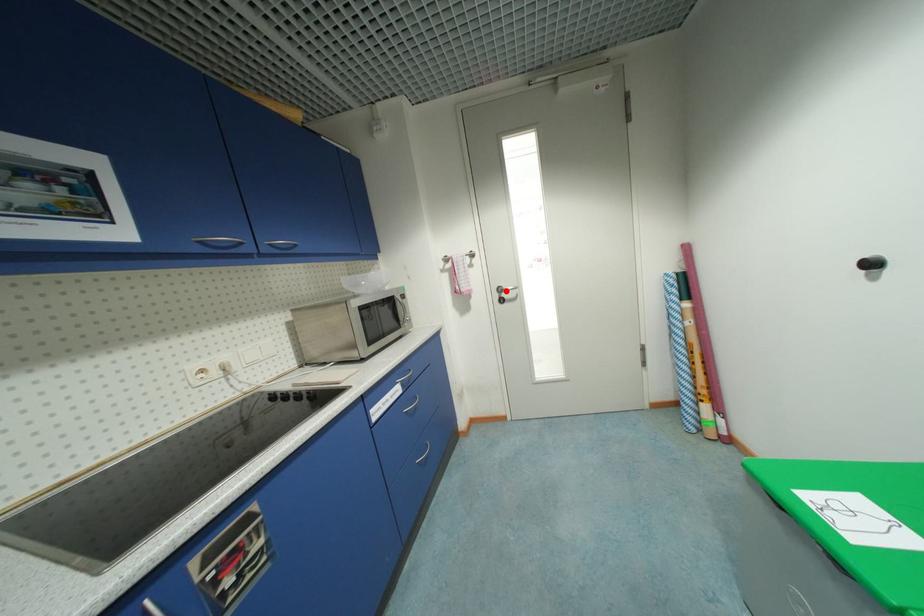
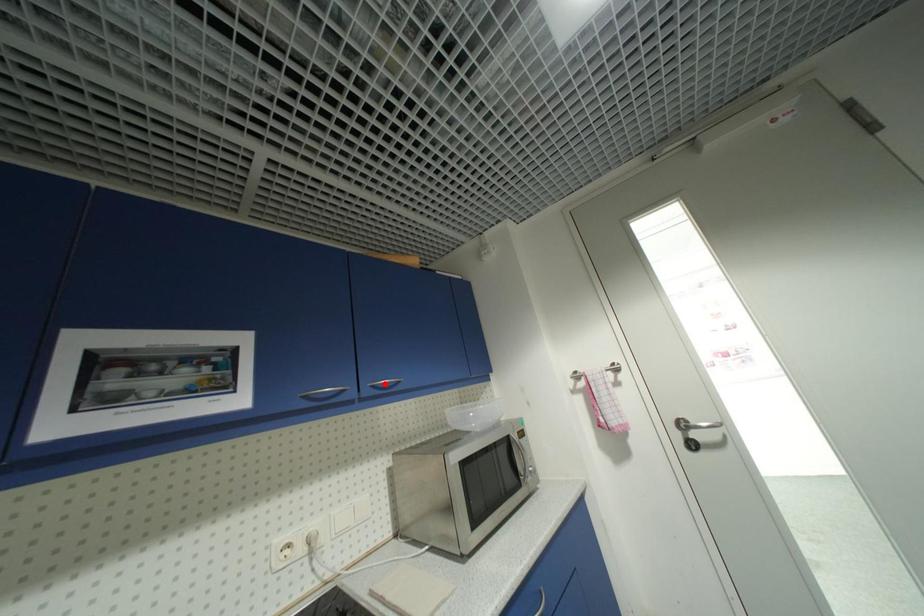
Based on the photo, I am providing you with two images of the same scene from different viewpoints. A red point is marked on the first image and another point is marked on the second image. Is the red point in image1 aligned with the point shown in image2?

No